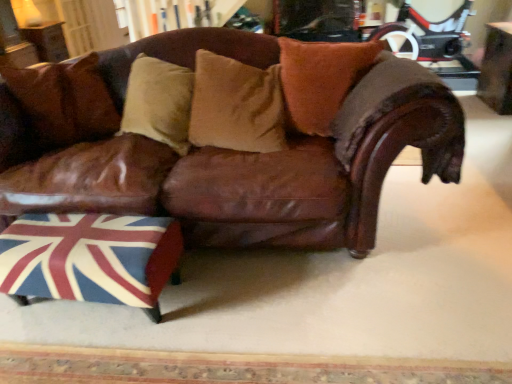
What is the approximate height of wooden table at upper right, positioned as the 1th table in front-to-back order?

wooden table at upper right, positioned as the 1th table in front-to-back order, is 24.76 inches tall.

This screenshot has height=384, width=512. What do you see at coordinates (236, 105) in the screenshot?
I see `suede-like tan pillow at center, which appears as the second pillow when viewed from the left` at bounding box center [236, 105].

Where is `wooden table at upper left, acting as the 2th table starting from the right`? This screenshot has height=384, width=512. wooden table at upper left, acting as the 2th table starting from the right is located at coordinates (47, 41).

What do you see at coordinates (61, 98) in the screenshot?
I see `brown suede pillow at upper left, the 3th pillow positioned from the right` at bounding box center [61, 98].

The height and width of the screenshot is (384, 512). I want to click on brown suede pillow at center, the third pillow when ordered from left to right, so click(321, 79).

From the image's perspective, is brown suede pillow at upper left, the first pillow from the left, over brown suede pillow at center, marked as the 1th pillow in a right-to-left arrangement?

No.

From a real-world perspective, is brown suede pillow at upper left, the first pillow from the left, positioned above or below brown suede pillow at center, the third pillow when ordered from left to right?

In terms of real-world spatial position, brown suede pillow at upper left, the first pillow from the left, is above brown suede pillow at center, the third pillow when ordered from left to right.

Considering the sizes of objects brown suede pillow at upper left, the first pillow from the left, and wooden table at upper left, arranged as the 1th table when viewed from the top, in the image provided, who is taller, brown suede pillow at upper left, the first pillow from the left, or wooden table at upper left, arranged as the 1th table when viewed from the top,?

wooden table at upper left, arranged as the 1th table when viewed from the top, is taller.

Who is smaller, brown suede pillow at upper left, the 3th pillow positioned from the right, or wooden table at upper left, acting as the 2th table starting from the right?

brown suede pillow at upper left, the 3th pillow positioned from the right.

Is brown suede pillow at upper left, the first pillow from the left, facing away from wooden table at upper left, the first table from the left?

Yes, brown suede pillow at upper left, the first pillow from the left, is facing away from wooden table at upper left, the first table from the left.

Considering the points (80, 75) and (181, 222), which point is behind, point (80, 75) or point (181, 222)?

The point (80, 75) is farther from the camera.

Is brown suede pillow at upper left, the 3th pillow positioned from the right, looking in the opposite direction of brown leather couch at center?

Yes, brown leather couch at center is at the back of brown suede pillow at upper left, the 3th pillow positioned from the right.

Locate an element on the screen. This screenshot has width=512, height=384. pillow on the left of the brown leather couch at center is located at coordinates (61, 98).

Consider the image. Between brown suede pillow at upper left, the 3th pillow positioned from the right, and brown leather couch at center, which one has more height?

Standing taller between the two is brown leather couch at center.

I want to click on table that is above the wooden table at upper right, the 2th table from the back (from the image's perspective), so click(47, 41).

Consider the image. From a real-world perspective, is wooden table at upper left, arranged as the 1th table when viewed from the top, located beneath wooden table at upper right, the 2th table positioned from the top?

No, from a real-world perspective, wooden table at upper left, arranged as the 1th table when viewed from the top, is not under wooden table at upper right, the 2th table positioned from the top.

Is wooden table at upper left, the 2th table in the bottom-to-top sequence, facing away from wooden table at upper right, positioned as the 1th table in front-to-back order?

No, wooden table at upper right, positioned as the 1th table in front-to-back order, is not at the back of wooden table at upper left, the 2th table in the bottom-to-top sequence.

The height and width of the screenshot is (384, 512). I want to click on studio couch below the brown suede pillow at upper left, the first pillow from the left (from the image's perspective), so click(x=262, y=172).

Is brown leather couch at center behind brown suede pillow at upper left, the 3th pillow positioned from the right?

No, it is in front of brown suede pillow at upper left, the 3th pillow positioned from the right.

Is brown leather couch at center aimed at brown suede pillow at upper left, the first pillow from the left?

Yes, brown leather couch at center faces towards brown suede pillow at upper left, the first pillow from the left.

Does brown leather couch at center have a greater width compared to brown suede pillow at upper left, the 3th pillow positioned from the right?

Correct, the width of brown leather couch at center exceeds that of brown suede pillow at upper left, the 3th pillow positioned from the right.

From the picture: Are wooden table at upper left, positioned as the second table in front-to-back order, and brown leather couch at center beside each other?

wooden table at upper left, positioned as the second table in front-to-back order, and brown leather couch at center are not in contact.

Does wooden table at upper left, acting as the 2th table starting from the right, contain brown leather couch at center?

No, brown leather couch at center is not inside wooden table at upper left, acting as the 2th table starting from the right.

From the image's perspective, is wooden table at upper left, which is the first table from back to front, above brown leather couch at center?

Correct, wooden table at upper left, which is the first table from back to front, appears higher than brown leather couch at center in the image.

From the picture: Considering the relative sizes of wooden table at upper left, the first table from the left, and brown leather couch at center in the image provided, is wooden table at upper left, the first table from the left, smaller than brown leather couch at center?

Yes, wooden table at upper left, the first table from the left, is smaller than brown leather couch at center.

Between point (489, 88) and point (335, 60), which one is positioned in front?

The point (335, 60) is closer to the camera.

Which object is closer to the camera taking this photo, wooden table at upper right, marked as the 2th table in a left-to-right arrangement, or brown suede pillow at center, the third pillow when ordered from left to right?

brown suede pillow at center, the third pillow when ordered from left to right, is closer to the camera.

From the image's perspective, who appears lower, wooden table at upper right, positioned as the 1th table in front-to-back order, or brown suede pillow at center, marked as the 1th pillow in a right-to-left arrangement?

brown suede pillow at center, marked as the 1th pillow in a right-to-left arrangement.

Where is `the 3rd pillow in front of the wooden table at upper right, which ranks as the 1th table in right-to-left order, starting your count from the anchor`? the 3rd pillow in front of the wooden table at upper right, which ranks as the 1th table in right-to-left order, starting your count from the anchor is located at coordinates (321, 79).

The image size is (512, 384). There is a brown suede pillow at upper left, the 3th pillow positioned from the right. Identify the location of the 1st pillow below it (from a real-world perspective). (321, 79).

At what (x,y) coordinates should I click in order to perform the action: click on the 2nd table behind the brown suede pillow at upper left, the first pillow from the left, starting your count from the anchor. Please return your answer as a coordinate pair (x, y). Looking at the image, I should click on (47, 41).

Which object lies further to the anchor point brown suede pillow at center, the third pillow when ordered from left to right, union jack fabric ottoman at lower left or suede-like tan pillow at center, which appears as the second pillow when viewed from the left?

The object further to brown suede pillow at center, the third pillow when ordered from left to right, is union jack fabric ottoman at lower left.

Considering their positions, is wooden table at upper right, marked as the 2th table in a left-to-right arrangement, positioned further to union jack fabric ottoman at lower left than wooden table at upper left, the first table from the left?

Based on the image, wooden table at upper left, the first table from the left, appears to be further to union jack fabric ottoman at lower left.

When comparing their distances from wooden table at upper right, positioned as the 1th table in front-to-back order, does brown suede pillow at center, the third pillow when ordered from left to right, or brown suede pillow at upper left, the 3th pillow positioned from the right, seem closer?

Based on the image, brown suede pillow at center, the third pillow when ordered from left to right, appears to be nearer to wooden table at upper right, positioned as the 1th table in front-to-back order.

In the scene shown: Based on their spatial positions, is brown suede pillow at center, the third pillow when ordered from left to right, or brown suede pillow at upper left, the 3th pillow positioned from the right, closer to wooden table at upper left, the first table from the left?

brown suede pillow at upper left, the 3th pillow positioned from the right, is positioned closer to the anchor wooden table at upper left, the first table from the left.

Based on their spatial positions, is brown leather couch at center or brown suede pillow at upper left, the 3th pillow positioned from the right, further from union jack fabric ottoman at lower left?

Among the two, brown suede pillow at upper left, the 3th pillow positioned from the right, is located further to union jack fabric ottoman at lower left.

Based on their spatial positions, is wooden table at upper left, which is the first table from back to front, or brown suede pillow at upper left, the 3th pillow positioned from the right, further from brown suede pillow at center, marked as the 1th pillow in a right-to-left arrangement?

wooden table at upper left, which is the first table from back to front.

Looking at the image, which one is located further to brown suede pillow at upper left, the first pillow from the left, wooden table at upper left, the 2th table in the bottom-to-top sequence, or suede-like tan pillow at center, placed as the second pillow when sorted from right to left?

Based on the image, wooden table at upper left, the 2th table in the bottom-to-top sequence, appears to be further to brown suede pillow at upper left, the first pillow from the left.

Looking at the image, which one is located further to wooden table at upper left, positioned as the second table in front-to-back order, brown suede pillow at center, marked as the 1th pillow in a right-to-left arrangement, or wooden table at upper right, marked as the 2th table in a left-to-right arrangement?

Based on the image, wooden table at upper right, marked as the 2th table in a left-to-right arrangement, appears to be further to wooden table at upper left, positioned as the second table in front-to-back order.

You are a GUI agent. You are given a task and a screenshot of the screen. Output one action in this format:
    pyautogui.click(x=<x>, y=<y>)
    Task: Click on the studio couch situated between union jack fabric ottoman at lower left and wooden table at upper right, the 2th table positioned from the top, from left to right
    The image size is (512, 384).
    Given the screenshot: What is the action you would take?
    pyautogui.click(x=262, y=172)

In order to click on studio couch between brown suede pillow at upper left, the first pillow from the left, and brown suede pillow at center, marked as the 1th pillow in a right-to-left arrangement, from left to right in this screenshot , I will do pos(262,172).

You are a GUI agent. You are given a task and a screenshot of the screen. Output one action in this format:
    pyautogui.click(x=<x>, y=<y>)
    Task: Click on the pillow located between brown suede pillow at upper left, the 3th pillow positioned from the right, and brown suede pillow at center, marked as the 1th pillow in a right-to-left arrangement, in the left-right direction
    This screenshot has height=384, width=512.
    Given the screenshot: What is the action you would take?
    pyautogui.click(x=236, y=105)

Find the location of a particular element. The height and width of the screenshot is (384, 512). studio couch located between brown suede pillow at upper left, the first pillow from the left, and wooden table at upper right, the 2th table positioned from the top, in the left-right direction is located at coordinates (262, 172).